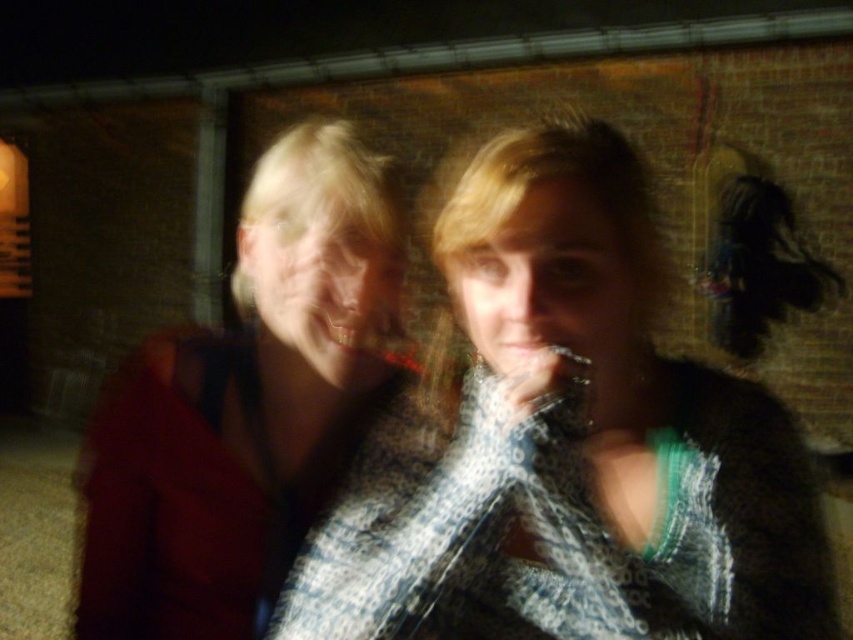
Question: Can you confirm if matte red jacket at left is positioned below matte plastic mouth at center?

Choices:
 (A) no
 (B) yes

Answer: (B)

Question: Considering the relative positions of matte red jacket at left and matte plastic mouth at center in the image provided, where is matte red jacket at left located with respect to matte plastic mouth at center?

Choices:
 (A) below
 (B) above

Answer: (A)

Question: Does matte red jacket at left appear on the left side of matte plastic mouth at center?

Choices:
 (A) yes
 (B) no

Answer: (A)